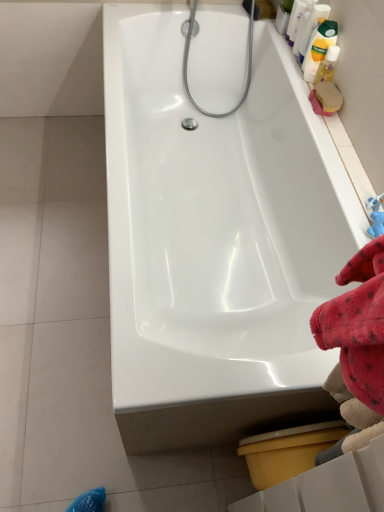
Question: Looking at their shapes, would you say chrome metallic shower head at upper center is wider or thinner than yellow matte bottle at upper right, which is counted as the 1th cleaning product, starting from the bottom?

Choices:
 (A) thin
 (B) wide

Answer: (B)

Question: From a real-world perspective, is chrome metallic shower head at upper center physically located above or below yellow matte bottle at upper right, which is counted as the 1th cleaning product, starting from the bottom?

Choices:
 (A) below
 (B) above

Answer: (A)

Question: Which object is the closest to the yellow matte bottle at upper right, which is the 3th cleaning product in top-to-bottom order?

Choices:
 (A) white glossy bottle at upper right, marked as the 4th cleaning product in a bottom-to-top arrangement
 (B) white glossy bathtub at center
 (C) translucent plastic bottle at upper right, which is the third cleaning product in bottom-to-top order
 (D) chrome metallic shower head at upper center
 (E) yellow plastic toilet bowl at lower right

Answer: (C)

Question: Which object is positioned closest to the white glossy bathtub at center?

Choices:
 (A) white glossy bottle at upper right, the 1th cleaning product viewed from the top
 (B) yellow plastic toilet bowl at lower right
 (C) translucent plastic bottle at upper right, which is the third cleaning product in bottom-to-top order
 (D) yellow matte bottle at upper right, the 4th cleaning product from the top
 (E) chrome metallic shower head at upper center

Answer: (E)